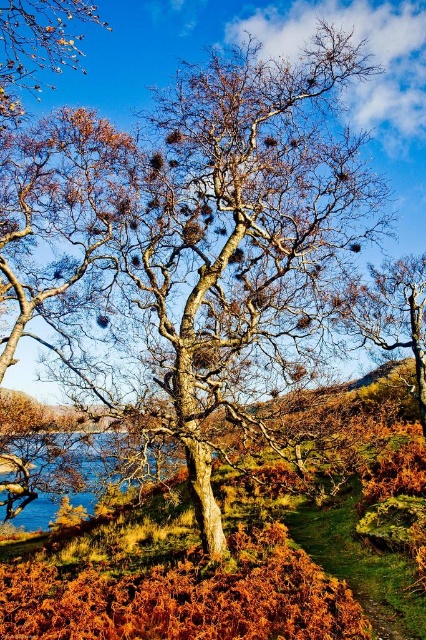
Consider the image. Does smooth brown tree at upper left appear on the right side of smooth bark tree at center?

In fact, smooth brown tree at upper left is to the left of smooth bark tree at center.

Between smooth brown tree at upper left and smooth bark tree at center, which one appears on the right side from the viewer's perspective?

smooth bark tree at center is more to the right.

Is point (28, 26) farther from viewer compared to point (368, 321)?

No, it is not.

Locate an element on the screen. The width and height of the screenshot is (426, 640). smooth brown tree at upper left is located at coordinates (37, 45).